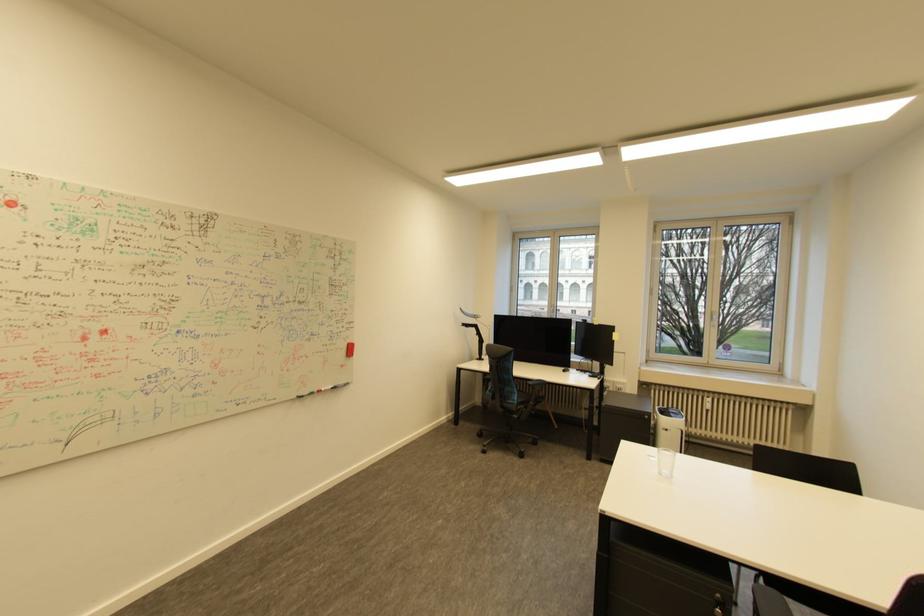
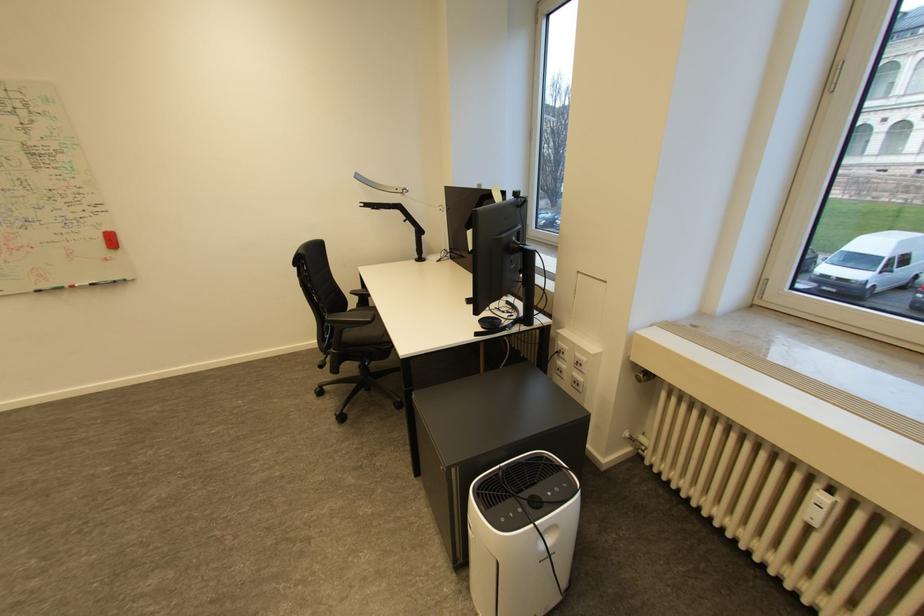
Where in the second image is the point corresponding to pixel 714 411 from the first image?

(816, 525)